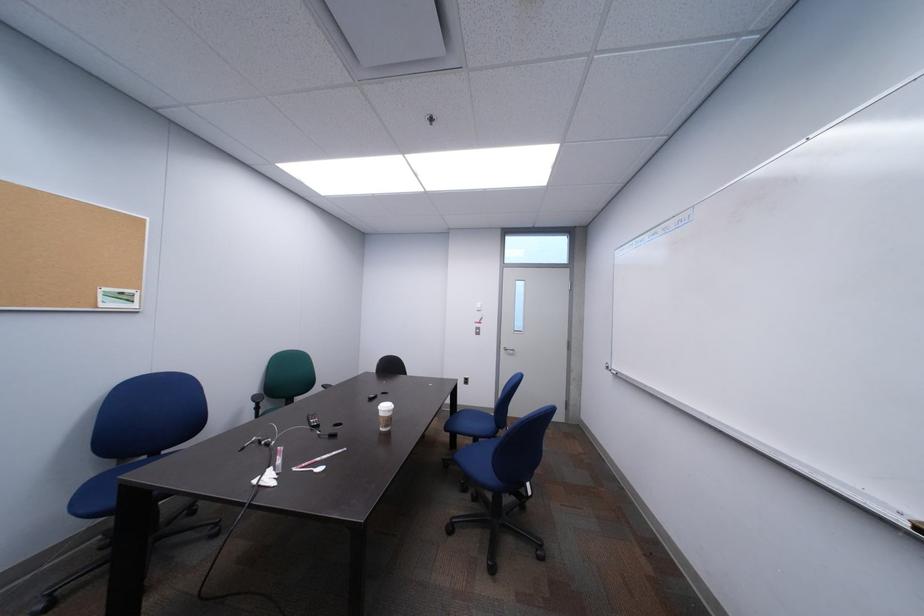
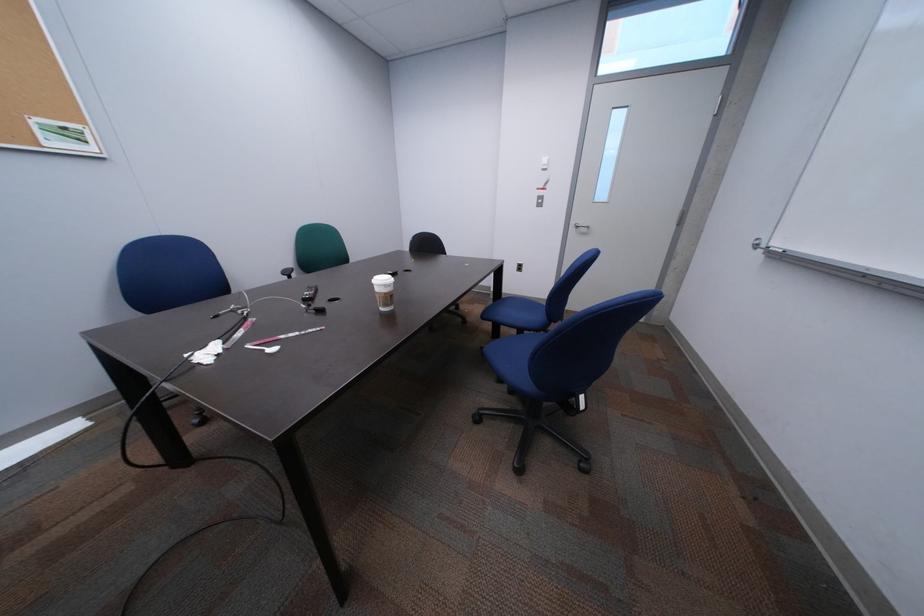
The first image is from the beginning of the video and the second image is from the end. How did the camera likely rotate when shooting the video?

The camera's rotation is toward left-down.